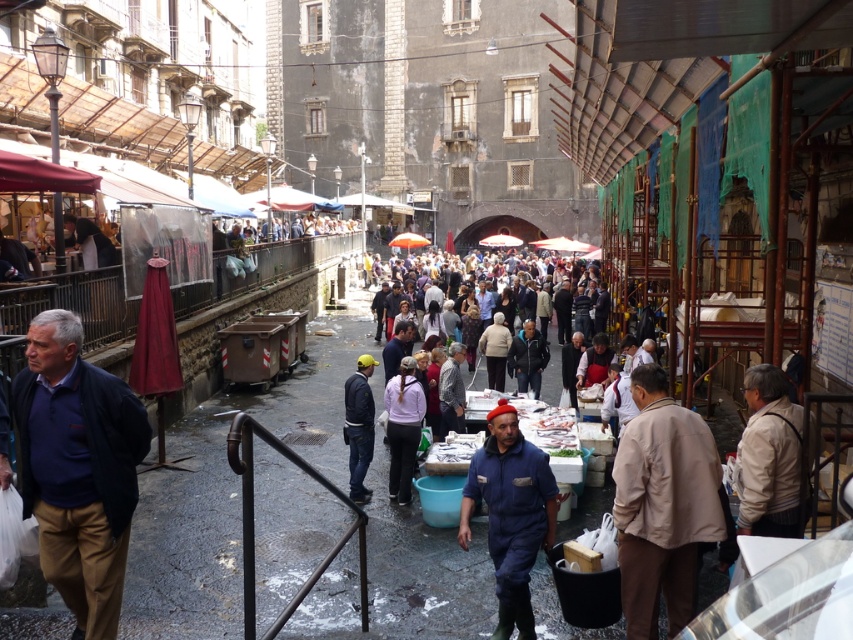
Is dark blue fabric jacket at left to the left of blue denim jumpsuit at center from the viewer's perspective?

Correct, you'll find dark blue fabric jacket at left to the left of blue denim jumpsuit at center.

Does point (76, 356) come closer to viewer compared to point (517, 577)?

Yes, it is in front of point (517, 577).

Identify the location of dark blue fabric jacket at left. (78, 468).

Between blue denim jumpsuit at center and white matte jacket at center, which one is positioned lower?

blue denim jumpsuit at center

Between blue denim jumpsuit at center and white matte jacket at center, which one appears on the right side from the viewer's perspective?

blue denim jumpsuit at center is more to the right.

Does point (526, 579) come in front of point (415, 401)?

Yes, it is in front of point (415, 401).

Image resolution: width=853 pixels, height=640 pixels. Find the location of `blue denim jumpsuit at center`. blue denim jumpsuit at center is located at coordinates (509, 513).

Can you confirm if dark blue fabric jacket at left is taller than white matte jacket at center?

Yes, dark blue fabric jacket at left is taller than white matte jacket at center.

Image resolution: width=853 pixels, height=640 pixels. I want to click on dark blue fabric jacket at left, so click(x=78, y=468).

Locate an element on the screen. dark blue fabric jacket at left is located at coordinates (78, 468).